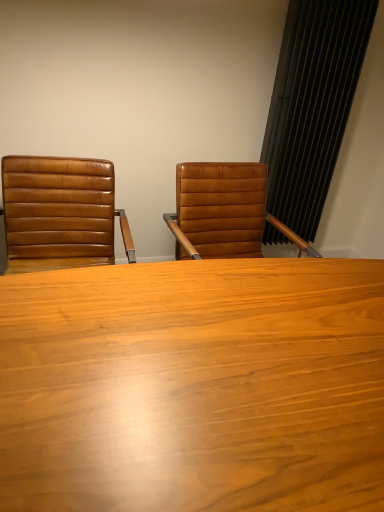
Question: Visually, is brown leather chair at left positioned to the left or to the right of black textured curtain at right?

Choices:
 (A) left
 (B) right

Answer: (A)

Question: From a real-world perspective, relative to black textured curtain at right, is brown leather chair at left vertically above or below?

Choices:
 (A) below
 (B) above

Answer: (A)

Question: Which object is the farthest from the black textured curtain at right?

Choices:
 (A) wooden table at center
 (B) brown leather chair at left

Answer: (A)

Question: Which object is the closest to the brown leather chair at left?

Choices:
 (A) wooden table at center
 (B) black textured curtain at right

Answer: (A)